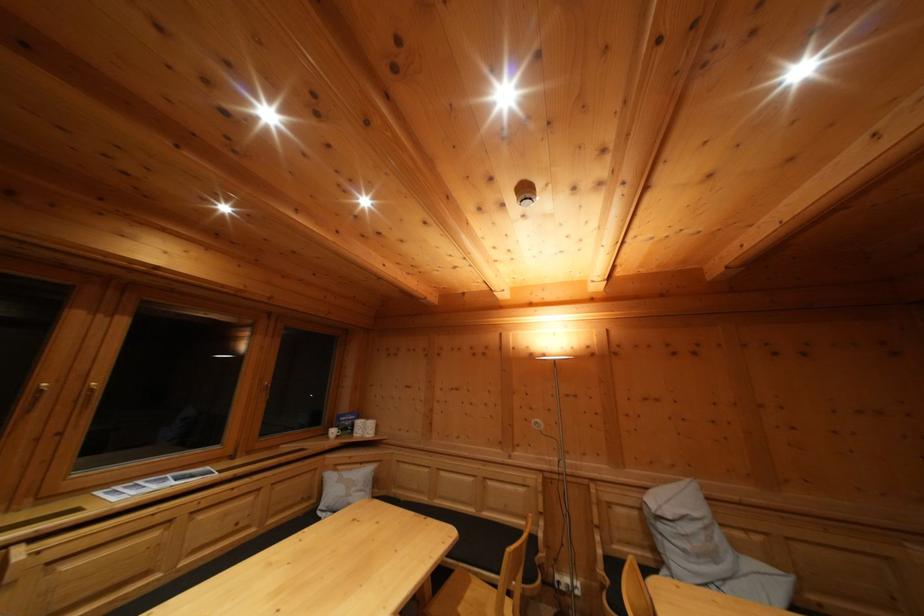
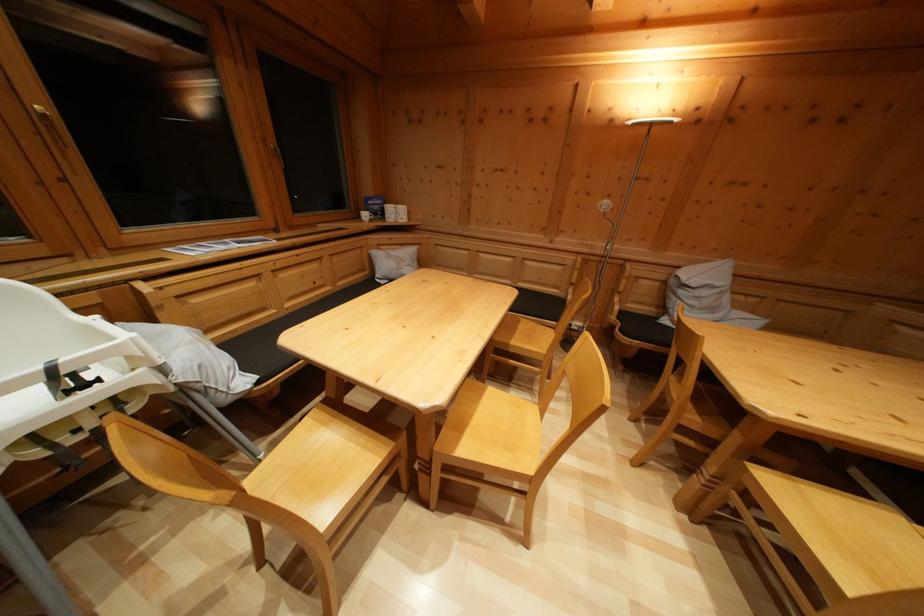
Question: Based on the continuous images, in which direction is the camera rotating? Reply with the corresponding letter.

Choices:
 (A) Left
 (B) Right
 (C) Up
 (D) Down

Answer: (D)